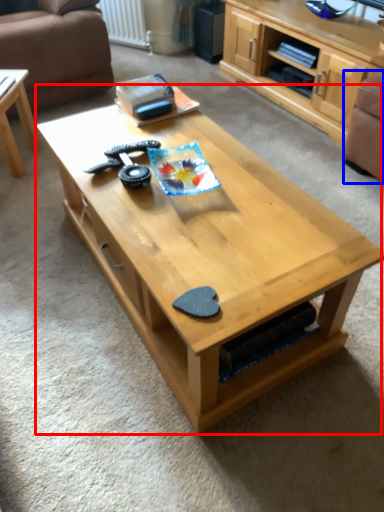
Question: Among these objects, which one is nearest to the camera, coffee table (highlighted by a red box) or armchair (highlighted by a blue box)?

Choices:
 (A) coffee table
 (B) armchair

Answer: (A)